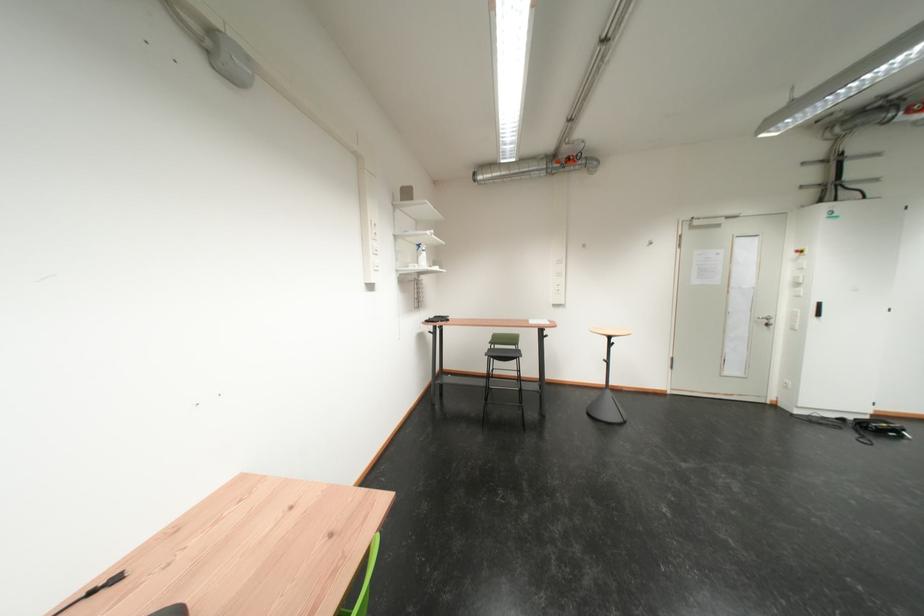
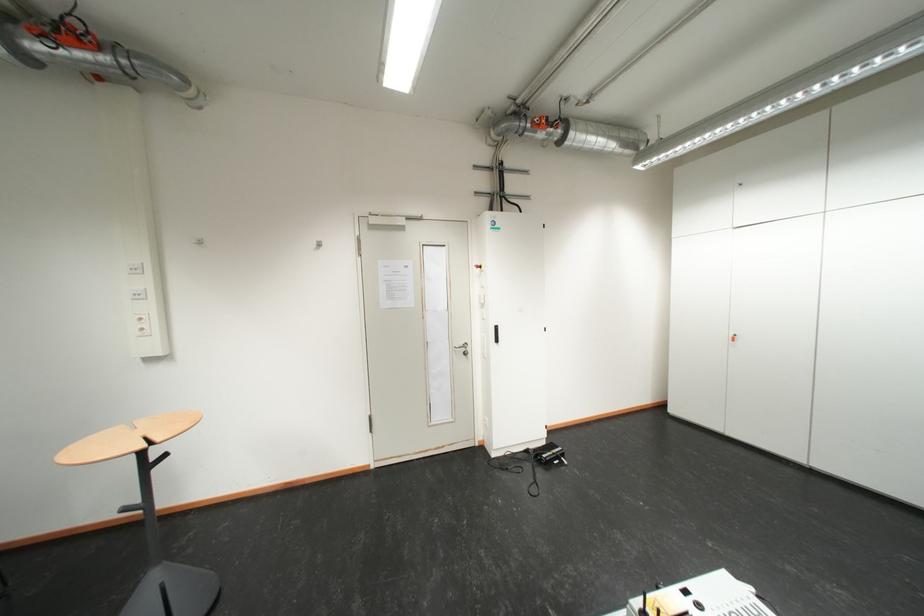
Locate, in the second image, the point that corresponds to the point at 831,306 in the first image.

(507, 330)